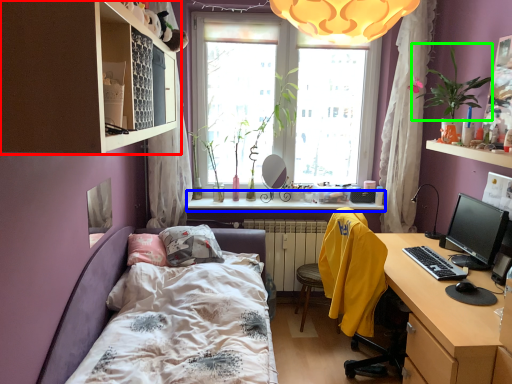
Question: Which object is positioned closest to shelf (highlighted by a red box)? Select from window sill (highlighted by a blue box) and plant (highlighted by a green box).

Choices:
 (A) window sill
 (B) plant

Answer: (B)